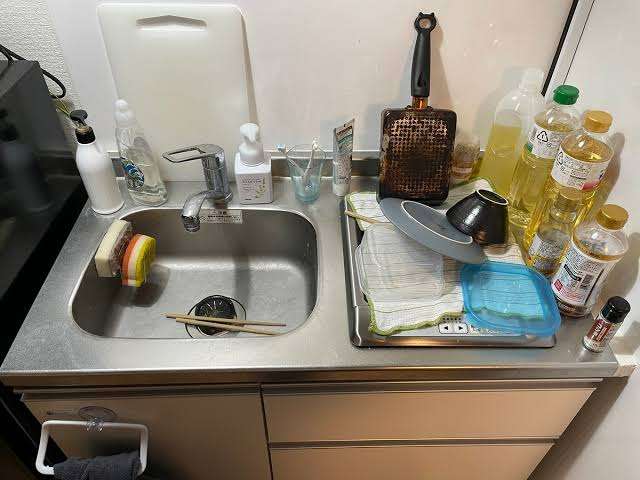
Locate an element on the screen. nap cloth hanger is located at coordinates (42, 466).